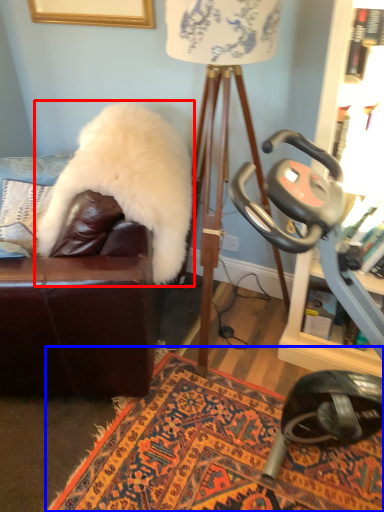
Question: Which object appears farthest to the camera in this image, fur coat (highlighted by a red box) or mat (highlighted by a blue box)?

Choices:
 (A) fur coat
 (B) mat

Answer: (A)